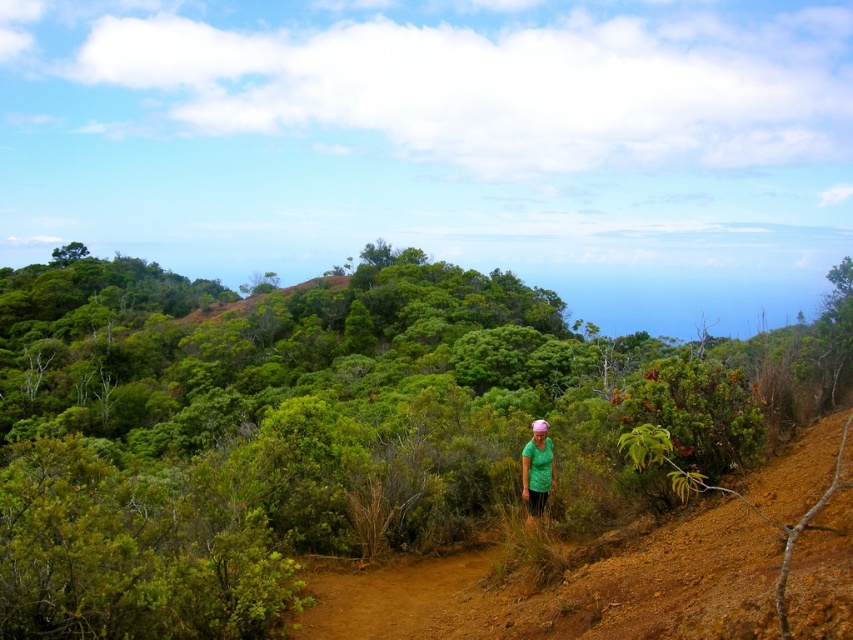
You are standing at the starting point of the dirt path in the image. Looking towards the middle ground, where exactly are the green leafy shrubs at center located in terms of coordinates?

The green leafy shrubs at center are located at coordinates point (305, 432).

You are a hiker standing on the dirt path and see the green leafy shrubs at center and the green matte shirt at center. Which object is taller?

The green leafy shrubs at center are taller than the green matte shirt at center.

You are standing on the dirt path in the image and see two points marked on the ground. The first point is at coordinates point (579, 380) and the second point is at point (555, 474). Which point is closer to you as you face the direction the person is walking?

Point (555, 474) is closer to you because point (579, 380) is behind it.